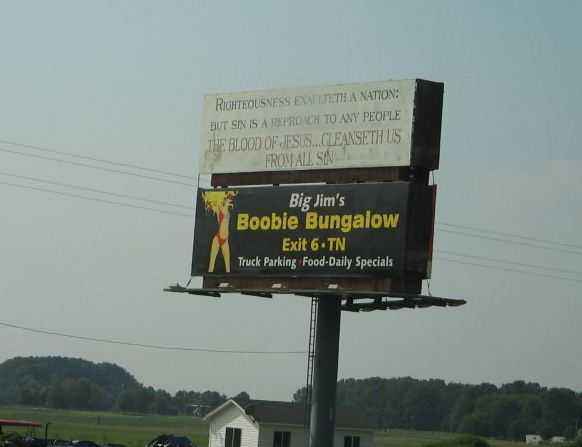
Identify the location of slider doors. (232, 442).